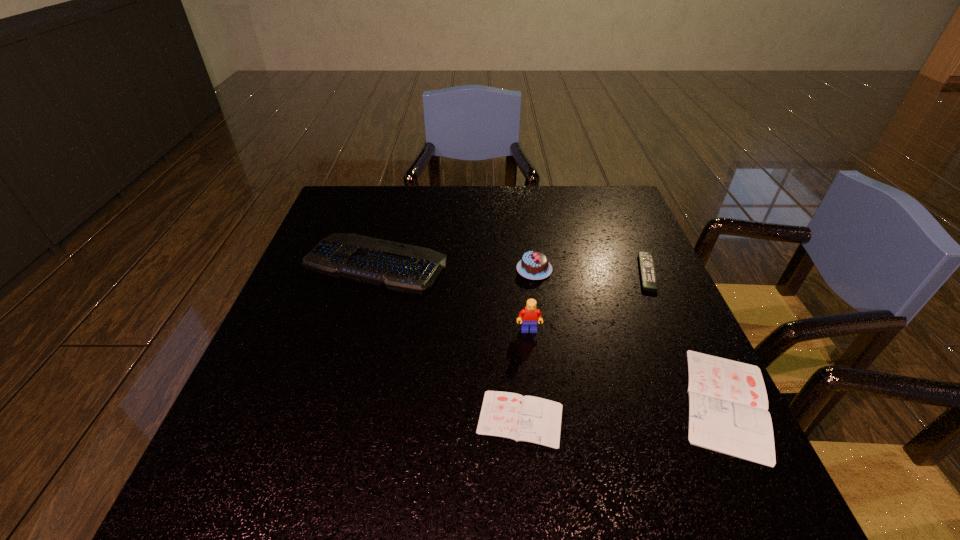
In the image, there is a desktop. Where is `vacant area at the near edge`? This screenshot has width=960, height=540. vacant area at the near edge is located at coordinates (337, 419).

Where is `vacant space at the left edge`? This screenshot has height=540, width=960. vacant space at the left edge is located at coordinates (331, 322).

You are a GUI agent. You are given a task and a screenshot of the screen. Output one action in this format:
    pyautogui.click(x=<x>, y=<y>)
    Task: Click on the blank space at the right edge
    
    Given the screenshot: What is the action you would take?
    pyautogui.click(x=631, y=261)

Image resolution: width=960 pixels, height=540 pixels. I want to click on free space at the far left corner, so click(x=345, y=208).

You are a GUI agent. You are given a task and a screenshot of the screen. Output one action in this format:
    pyautogui.click(x=<x>, y=<y>)
    Task: Click on the vacant area at the far right corner of the desktop
    The width and height of the screenshot is (960, 540).
    Given the screenshot: What is the action you would take?
    pyautogui.click(x=604, y=206)

Where is `unoccupied position between the fourth farthest object and the remote control`? This screenshot has width=960, height=540. unoccupied position between the fourth farthest object and the remote control is located at coordinates (588, 301).

Where is `vacant area that lies between the taller diary and the chocolate cake`? vacant area that lies between the taller diary and the chocolate cake is located at coordinates (x=630, y=336).

This screenshot has height=540, width=960. Find the location of `vacant area that lies between the Lego and the remote control`. vacant area that lies between the Lego and the remote control is located at coordinates (588, 301).

You are a GUI agent. You are given a task and a screenshot of the screen. Output one action in this format:
    pyautogui.click(x=<x>, y=<y>)
    Task: Click on the vacant space in between the left diary and the taller diary
    Image resolution: width=960 pixels, height=540 pixels.
    Given the screenshot: What is the action you would take?
    pyautogui.click(x=623, y=410)

The image size is (960, 540). Identify the location of blank region between the taller diary and the leftmost object. click(x=551, y=333).